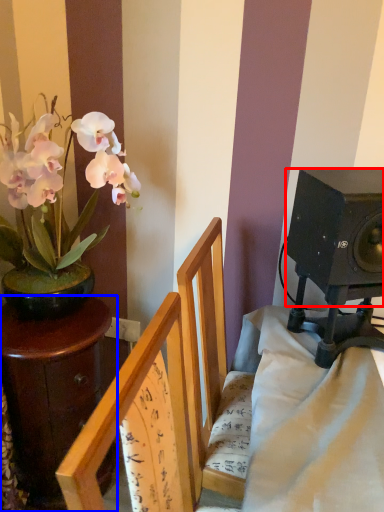
Question: Which point is closer to the camera, loudspeaker (highlighted by a red box) or table (highlighted by a blue box)?

Choices:
 (A) loudspeaker
 (B) table

Answer: (A)